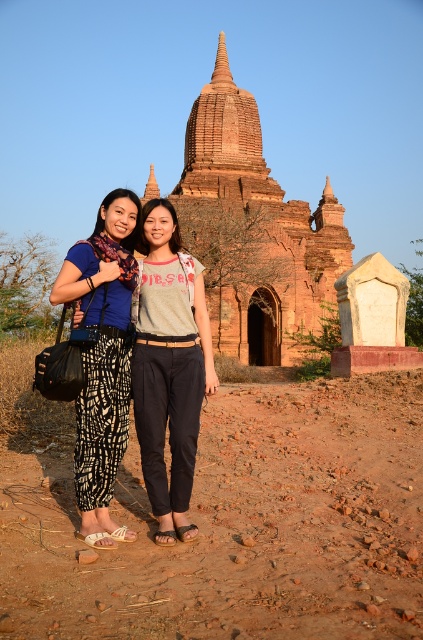
Question: Which object is farther from the camera taking this photo?

Choices:
 (A) rustic brick temple at center
 (B) printed fabric pants at center
 (C) light gray cotton shirt at center

Answer: (A)

Question: Which is farther from the light gray cotton shirt at center?

Choices:
 (A) printed fabric pants at center
 (B) brown dirt field at lower center
 (C) rustic brick temple at center

Answer: (C)

Question: Considering the relative positions of brown dirt field at lower center and rustic brick temple at center in the image provided, where is brown dirt field at lower center located with respect to rustic brick temple at center?

Choices:
 (A) above
 (B) below

Answer: (B)

Question: Where is light gray cotton shirt at center located in relation to printed fabric pants at center in the image?

Choices:
 (A) right
 (B) left

Answer: (A)

Question: Can you confirm if brown dirt field at lower center is positioned below printed fabric pants at center?

Choices:
 (A) no
 (B) yes

Answer: (B)

Question: Which object is the closest to the brown dirt field at lower center?

Choices:
 (A) printed fabric pants at center
 (B) rustic brick temple at center

Answer: (A)